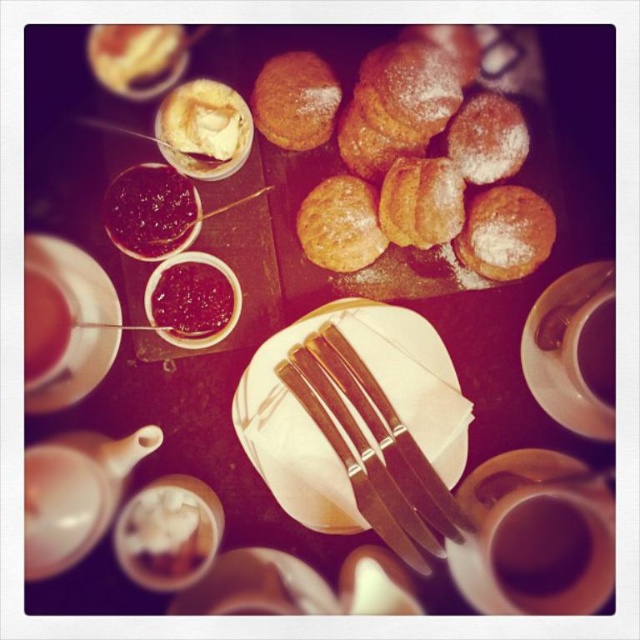
You are a tea lover who wants to pour cream into your cup. You are currently holding the brown ceramic cup at right. Which direction should you move to reach the white fluffy cream at center?

The white fluffy cream at center is further to the viewer than the brown ceramic cup at right, so you should move towards yourself to reach the white fluffy cream at center.

You are a tea server arranging items on the table. You need to place a teapot exactly halfway between point A at point (45, 273) and point B at point (80, 326). Where should you place the teapot?

The teapot should be placed at the midpoint between point A at point (45, 273) and point B at point (80, 326). To calculate the midpoint, average the x and y coordinates of both points. The midpoint would be at coordinates x_avg and y_avg, where x_avg is 0.428 plus 0.512 divided by 2, and y_avg is 0.072 plus 0.125 divided by 2. This ensures the teapot is equidistant from both points.

You are setting up a tea tray and need to place the white fluffy cream at center and the brown ceramic cup at right. If the space between them must be exactly 10 cm, can you fit both items on the table without overlapping?

The white fluffy cream at center might be wider than the brown ceramic cup at right, so it is uncertain if they can fit within 10 cm without overlapping. Measure their widths to confirm.